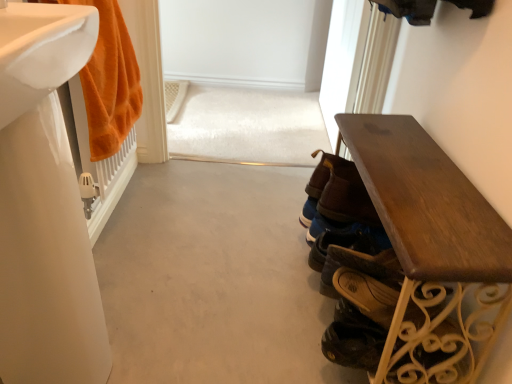
Locate an element on the screen. Image resolution: width=512 pixels, height=384 pixels. blank space above wooden bench at right (from a real-world perspective) is located at coordinates (433, 184).